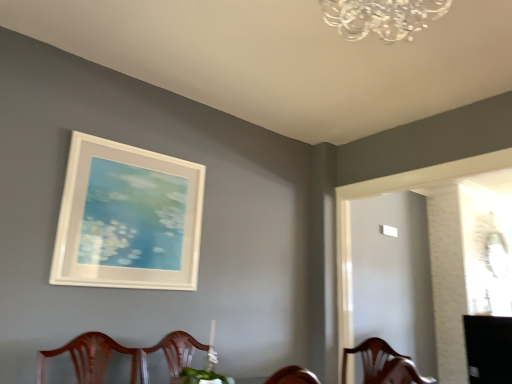
Question: Looking at the image, does black glossy table at lower right seem bigger or smaller compared to white matte picture frame at upper center?

Choices:
 (A) small
 (B) big

Answer: (B)

Question: Looking at their shapes, would you say black glossy table at lower right is wider or thinner than white matte picture frame at upper center?

Choices:
 (A) thin
 (B) wide

Answer: (B)

Question: From a real-world perspective, is black glossy table at lower right above or below white matte picture frame at upper center?

Choices:
 (A) below
 (B) above

Answer: (A)

Question: From a real-world perspective, relative to black glossy table at lower right, is white matte picture frame at upper center vertically above or below?

Choices:
 (A) below
 (B) above

Answer: (B)

Question: Looking at the image, does white matte picture frame at upper center seem bigger or smaller compared to black glossy table at lower right?

Choices:
 (A) big
 (B) small

Answer: (B)

Question: Is white matte picture frame at upper center inside or outside of black glossy table at lower right?

Choices:
 (A) inside
 (B) outside

Answer: (B)

Question: In the image, is white matte picture frame at upper center on the left side or the right side of black glossy table at lower right?

Choices:
 (A) right
 (B) left

Answer: (B)